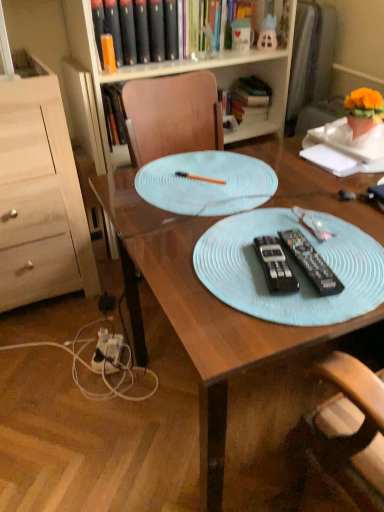
Find the location of a particular element. The image size is (384, 512). vacant space behind white plastic power outlet at lower left is located at coordinates (91, 321).